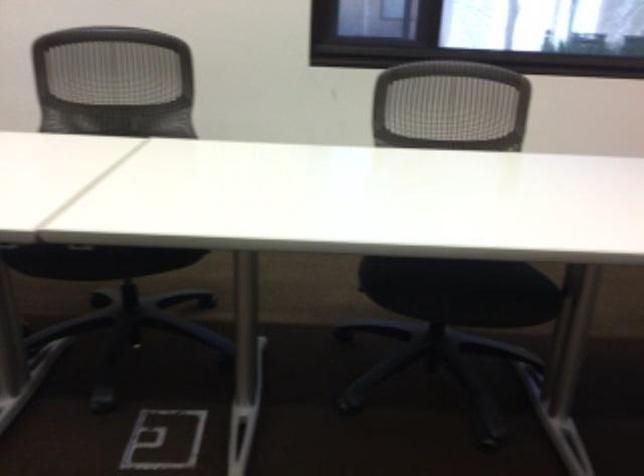
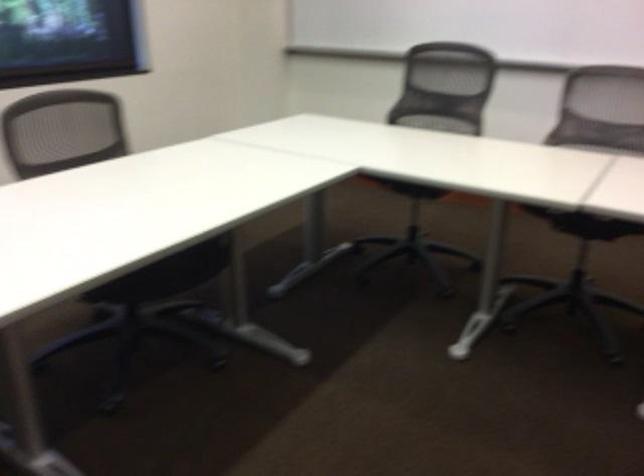
Question: How did the camera likely rotate?

Choices:
 (A) Left
 (B) Right
 (C) Up
 (D) Down

Answer: (B)